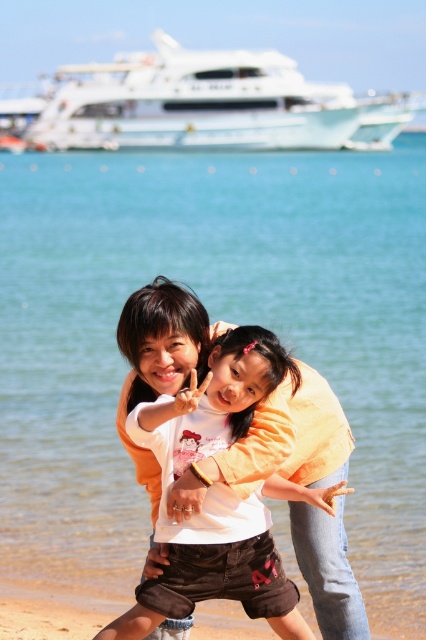
Question: Is white glossy boat at upper center smaller than matte orange shirt at center?

Choices:
 (A) no
 (B) yes

Answer: (A)

Question: In this image, where is white glossy boat at upper center located relative to matte orange shirt at center?

Choices:
 (A) below
 (B) above

Answer: (B)

Question: Which object appears farthest from the camera in this image?

Choices:
 (A) matte orange shirt at center
 (B) white glossy boat at upper center

Answer: (B)

Question: Can you confirm if white glossy boat at upper center is positioned to the right of matte orange shirt at center?

Choices:
 (A) no
 (B) yes

Answer: (A)

Question: Which point is closer to the camera?

Choices:
 (A) white glossy boat at upper center
 (B) matte orange shirt at center

Answer: (B)